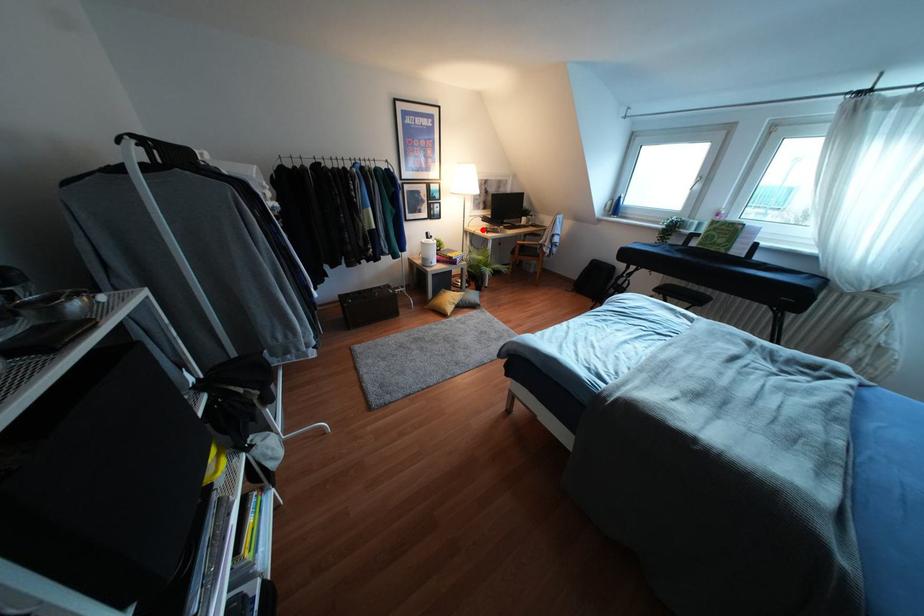
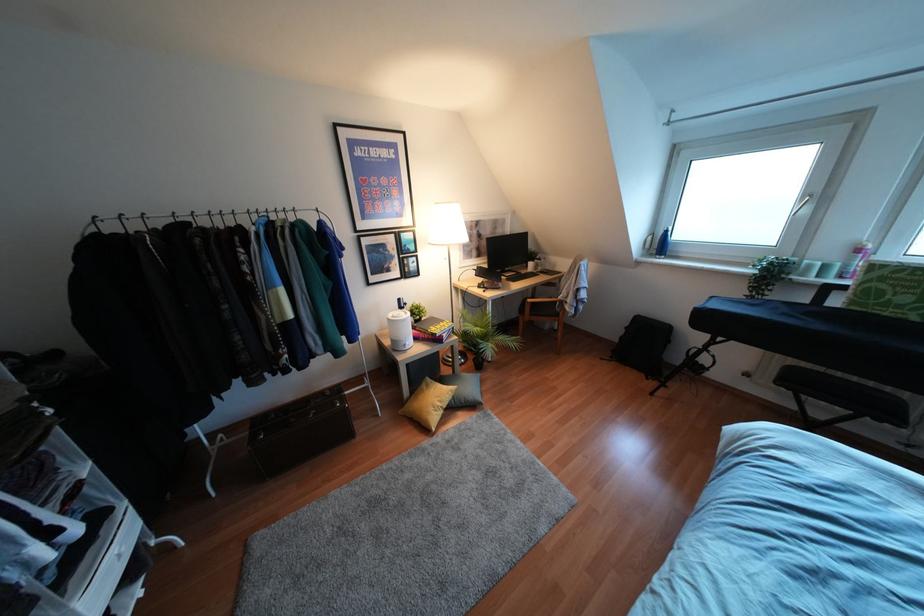
Question: I am providing you with two images of the same scene from different viewpoints. In image1, a red point is highlighted. Considering the same 3D point in image2, which of the following is correct?

Choices:
 (A) It is closer
 (B) It is farther

Answer: (B)